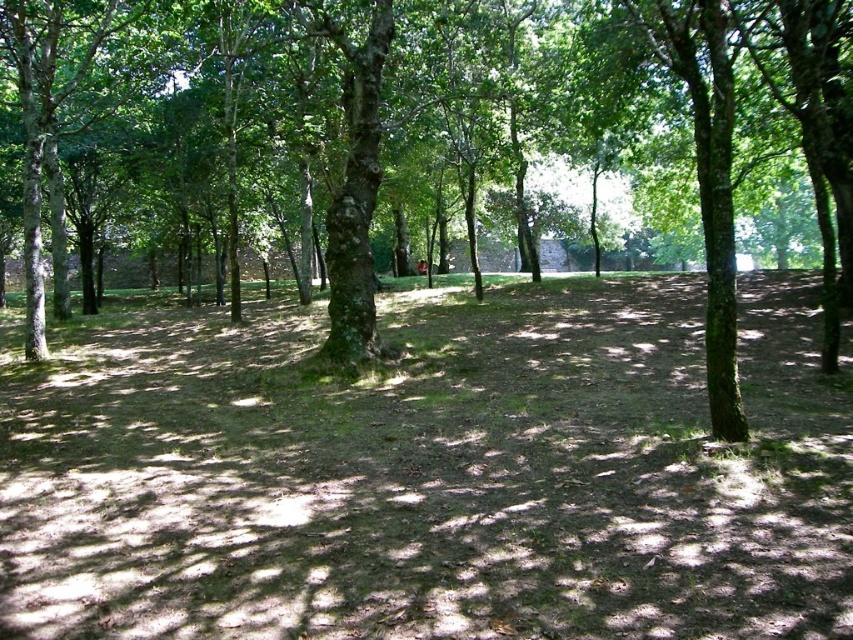
Is brown/dry soil at center closer to the viewer compared to green rough bark tree at center?

Yes, it is in front of green rough bark tree at center.

In the scene shown: Is the position of brown/dry soil at center more distant than that of green rough bark tree at center?

No, it is not.

Between point (601, 541) and point (158, 172), which one is positioned in front?

Positioned in front is point (601, 541).

Image resolution: width=853 pixels, height=640 pixels. I want to click on brown/dry soil at center, so click(x=428, y=472).